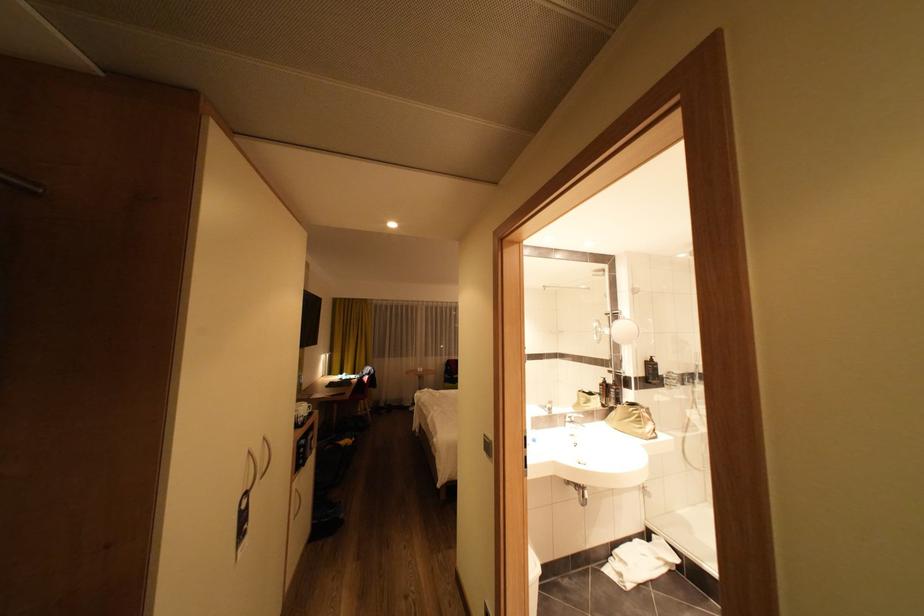
The location [631,419] corresponds to which object?

It corresponds to the beige pouch in the image.